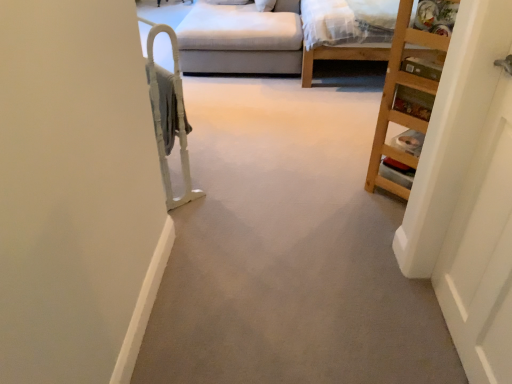
Question: From a real-world perspective, is white plastic bunk bed at left above or below wooden bed frame at upper right?

Choices:
 (A) above
 (B) below

Answer: (A)

Question: Is white plastic bunk bed at left bigger or smaller than wooden bed frame at upper right?

Choices:
 (A) big
 (B) small

Answer: (B)

Question: Which of these objects is positioned farthest from the wooden bed frame at upper right?

Choices:
 (A) light beige fabric couch at upper center
 (B) white plastic bunk bed at left
 (C) white wooden door at right
 (D) wooden bookshelf at right

Answer: (C)

Question: Considering the real-world distances, which object is farthest from the white plastic bunk bed at left?

Choices:
 (A) white wooden door at right
 (B) wooden bookshelf at right
 (C) wooden bed frame at upper right
 (D) light beige fabric couch at upper center

Answer: (D)